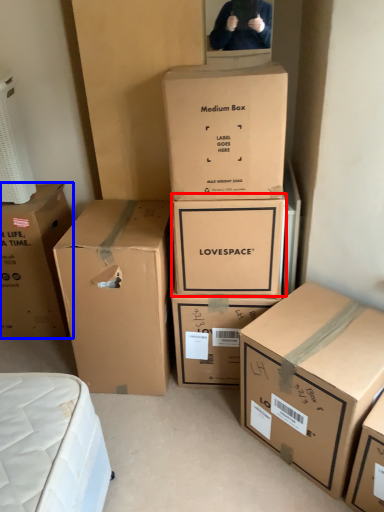
Question: Which of the following is the farthest to the observer, box (highlighted by a red box) or box (highlighted by a blue box)?

Choices:
 (A) box
 (B) box

Answer: (B)